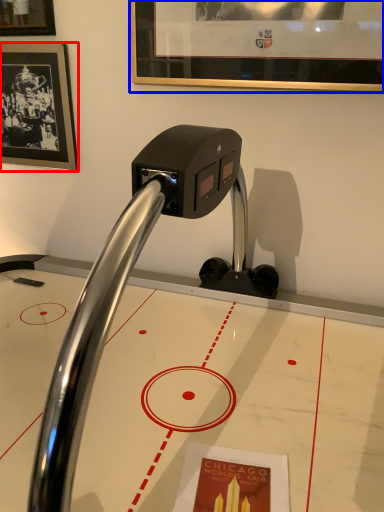
Question: Which object appears closest to the camera in this image, picture frame (highlighted by a red box) or picture frame (highlighted by a blue box)?

Choices:
 (A) picture frame
 (B) picture frame

Answer: (B)